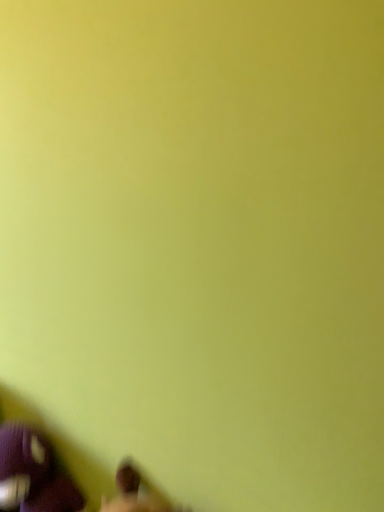
What do you see at coordinates (33, 474) in the screenshot? The width and height of the screenshot is (384, 512). I see `purple fabric at bottom left` at bounding box center [33, 474].

This screenshot has width=384, height=512. Find the location of `purple fabric at bottom left`. purple fabric at bottom left is located at coordinates (33, 474).

You are a GUI agent. You are given a task and a screenshot of the screen. Output one action in this format:
    pyautogui.click(x=<x>, y=<y>)
    Task: Click on the purple fabric at bottom left
    
    Given the screenshot: What is the action you would take?
    pyautogui.click(x=33, y=474)